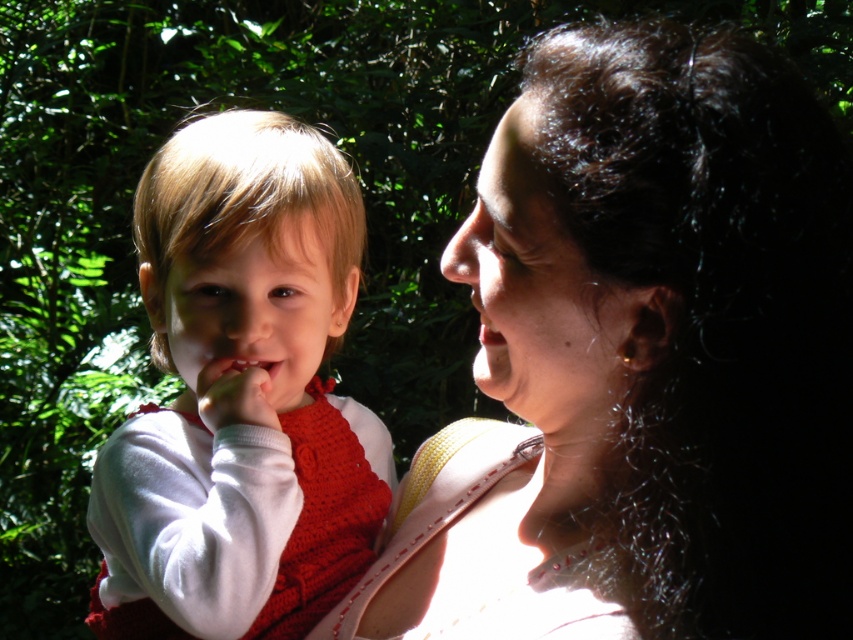
You are a photographer reviewing the image. You notice the white crochet vest at left and the matte white teeth at center. Which object is positioned lower in the frame?

The white crochet vest at left is positioned below the matte white teeth at center, so it is lower in the frame.

In the scene where a mother and child are interacting, you are a dentist examining their facial features. You notice the smooth skin nose at center and the matte white teeth at center. Which of these two features is taller?

The smooth skin nose at center is taller than the matte white teeth at center.

You are a dentist examining a patient. You notice two features in the mouth area of the patient. The first is the matte skin nose at center and the second is the matte white teeth at center. How far apart are these two features?

The matte skin nose at center is 1.24 inches away from the matte white teeth at center.